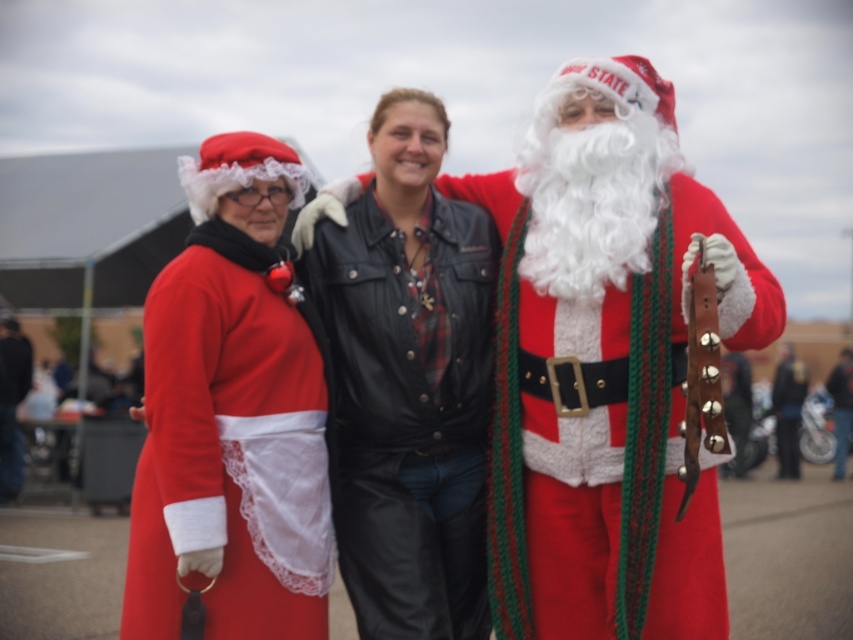
The height and width of the screenshot is (640, 853). Describe the element at coordinates (606, 364) in the screenshot. I see `fuzzy white beard at center` at that location.

Measure the distance from fuzzy white beard at center to shiny metallic belt at center.

fuzzy white beard at center and shiny metallic belt at center are 24.68 meters apart.

Identify the location of fuzzy white beard at center. The height and width of the screenshot is (640, 853). (606, 364).

What are the coordinates of `fuzzy white beard at center` in the screenshot? It's located at (606, 364).

In order to click on matte red dress at center in this screenshot , I will do `click(231, 417)`.

Between matte red dress at center and shiny metallic belt at center, which one has more height?

matte red dress at center is taller.

Find the location of `matte red dress at center`. matte red dress at center is located at coordinates (231, 417).

How distant is leather jacket at center from dark blue leather jacket at left?

leather jacket at center is 16.45 meters from dark blue leather jacket at left.

Does leather jacket at center have a smaller size compared to dark blue leather jacket at left?

Yes, leather jacket at center is smaller than dark blue leather jacket at left.

Is point (463, 282) farther from camera compared to point (21, 438)?

No, (463, 282) is closer to viewer.

Locate an element on the screen. leather jacket at center is located at coordinates (407, 378).